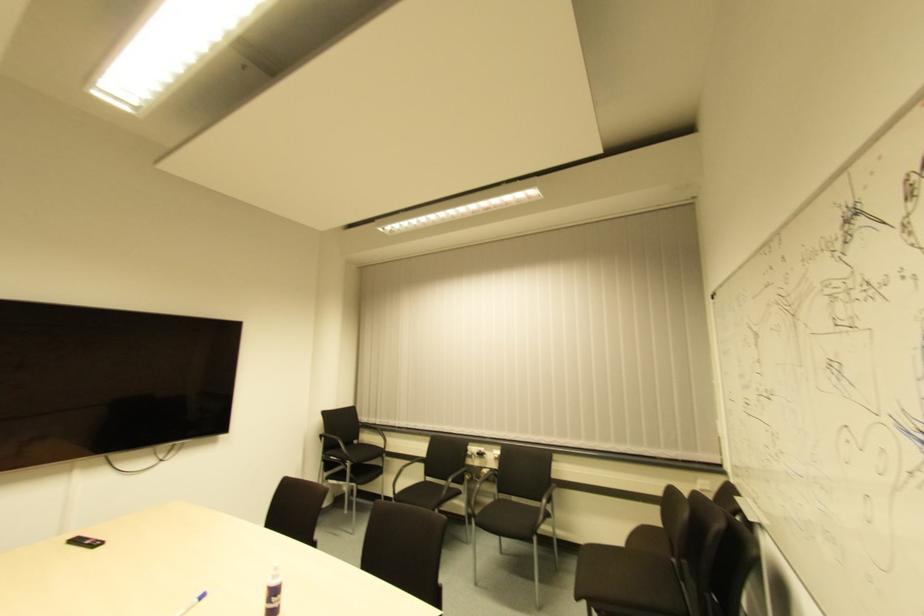
The image size is (924, 616). I want to click on purple spray bottle, so click(273, 593).